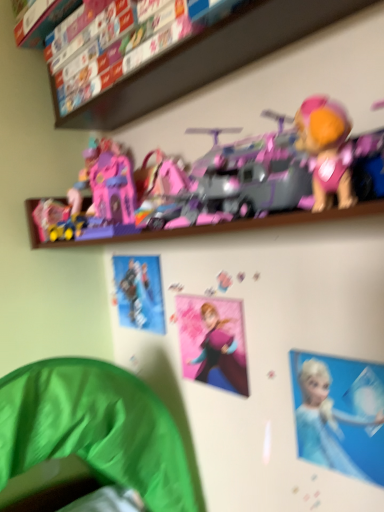
Question: From the image's perspective, would you say pink plastic castle at upper center, acting as the second toy starting from the bottom, is positioned over blue glossy poster at upper center, the 2th person when ordered from left to right?

Choices:
 (A) no
 (B) yes

Answer: (B)

Question: Would you say pink plastic castle at upper center, acting as the second toy starting from the bottom, is outside blue glossy poster at upper center, positioned as the second person in top-to-bottom order?

Choices:
 (A) yes
 (B) no

Answer: (A)

Question: Can you confirm if pink plastic castle at upper center, placed as the 1th toy when sorted from top to bottom, is taller than blue glossy poster at upper center, positioned as the second person in top-to-bottom order?

Choices:
 (A) yes
 (B) no

Answer: (B)

Question: Is blue glossy poster at upper center, arranged as the 1th person when viewed from the right, inside pink plastic castle at upper center, placed as the 1th toy when sorted from top to bottom?

Choices:
 (A) yes
 (B) no

Answer: (B)

Question: Does pink plastic castle at upper center, acting as the second toy starting from the bottom, come behind blue glossy poster at upper center, positioned as the second person in top-to-bottom order?

Choices:
 (A) yes
 (B) no

Answer: (B)

Question: Is there a large distance between pink plastic castle at upper center, placed as the 1th toy when sorted from top to bottom, and blue glossy poster at upper center, arranged as the first person when viewed from the front?

Choices:
 (A) no
 (B) yes

Answer: (A)

Question: Is pink plastic castle at upper center, acting as the second toy starting from the bottom, beside metallic silver figure at upper center, which ranks as the 1th person in top-to-bottom order?

Choices:
 (A) yes
 (B) no

Answer: (B)

Question: Is pink plastic castle at upper center, acting as the second toy starting from the bottom, positioned with its back to metallic silver figure at upper center, the first person from the back?

Choices:
 (A) yes
 (B) no

Answer: (B)

Question: From the image's perspective, is pink plastic castle at upper center, acting as the second toy starting from the bottom, below metallic silver figure at upper center, the second person when ordered from bottom to top?

Choices:
 (A) no
 (B) yes

Answer: (A)

Question: Does pink plastic castle at upper center, acting as the second toy starting from the bottom, have a lesser width compared to metallic silver figure at upper center, the second person when ordered from bottom to top?

Choices:
 (A) yes
 (B) no

Answer: (B)

Question: From a real-world perspective, is pink plastic castle at upper center, placed as the 1th toy when sorted from top to bottom, located higher than metallic silver figure at upper center, which ranks as the 1th person in top-to-bottom order?

Choices:
 (A) no
 (B) yes

Answer: (B)

Question: Is pink plastic castle at upper center, placed as the 1th toy when sorted from top to bottom, positioned before metallic silver figure at upper center, which ranks as the 1th person in top-to-bottom order?

Choices:
 (A) yes
 (B) no

Answer: (A)

Question: Is pink plastic castle at upper center, acting as the second toy starting from the bottom, located outside pink matte anna poster at center, the first toy in the bottom-to-top sequence?

Choices:
 (A) yes
 (B) no

Answer: (A)